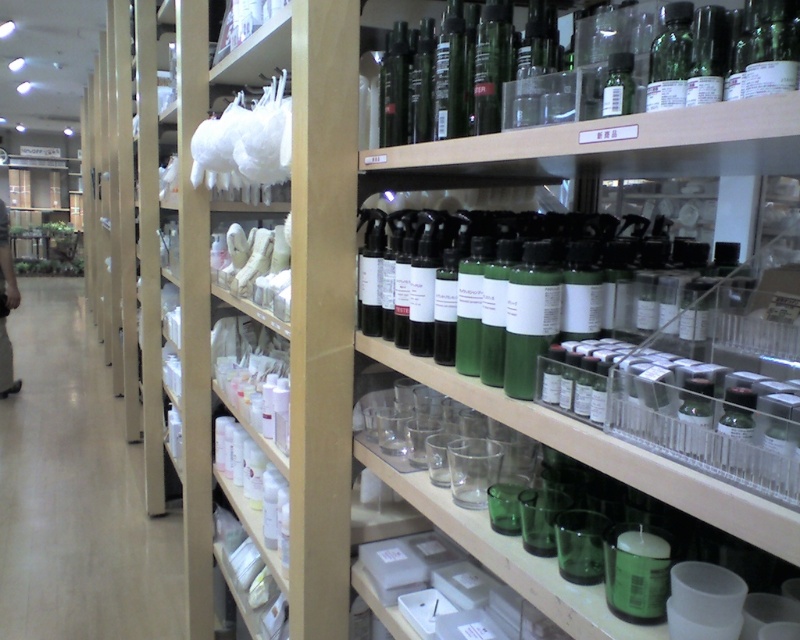
Who is more distant from viewer, (258, 182) or (708, 12)?

Point (258, 182)

Between white fabric at upper left and green glass bottle at center, which one appears on the left side from the viewer's perspective?

white fabric at upper left

What are the coordinates of `white fabric at upper left` in the screenshot? It's located at (254, 371).

Identify the location of white fabric at upper left. click(x=254, y=371).

Between point (682, 100) and point (628, 52), which one is positioned in front?

Point (682, 100) is in front.

Locate an element on the screen. green glass bottle at upper right is located at coordinates (670, 58).

Does point (664, 68) come behind point (602, 99)?

No, (664, 68) is closer to viewer.

Identify the location of green glass bottle at upper right. This screenshot has width=800, height=640. (670, 58).

Is white plastic cups at left positioned behind white fabric at upper left?

Yes, it is behind white fabric at upper left.

Does point (2, 529) come behind point (216, 337)?

Yes, it is behind point (216, 337).

Between point (160, 554) and point (276, 77), which one is positioned behind?

The point (160, 554) is behind.

Identify the location of white plastic cups at left. The height and width of the screenshot is (640, 800). (76, 492).